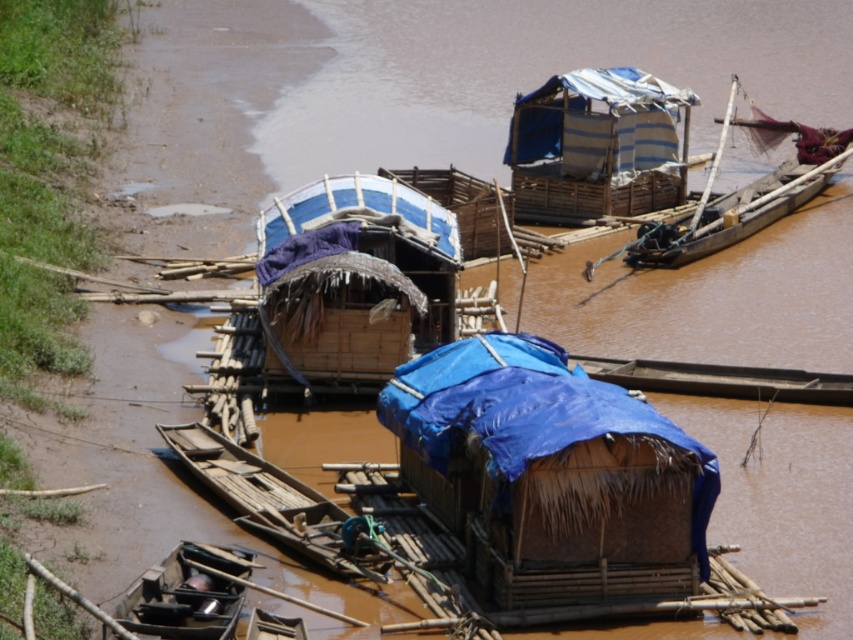
Looking at this image, does blue striped tarp at upper center appear under wooden boat at right?

No.

Can you confirm if blue striped tarp at upper center is bigger than wooden boat at right?

Actually, blue striped tarp at upper center might be smaller than wooden boat at right.

The width and height of the screenshot is (853, 640). What do you see at coordinates (598, 145) in the screenshot?
I see `blue striped tarp at upper center` at bounding box center [598, 145].

Where is `blue striped tarp at upper center`? The height and width of the screenshot is (640, 853). blue striped tarp at upper center is located at coordinates (598, 145).

Can you confirm if wooden boat at center is smaller than black matte boat at lower left?

No, wooden boat at center is not smaller than black matte boat at lower left.

Which is behind, point (279, 516) or point (236, 576)?

The point (279, 516) is more distant.

Is point (244, 474) farther from camera compared to point (158, 630)?

Yes, it is behind point (158, 630).

At what (x,y) coordinates should I click in order to perform the action: click on wooden boat at center. Please return your answer as a coordinate pair (x, y). The image size is (853, 640). Looking at the image, I should click on (268, 497).

Who is positioned more to the left, blue tarpaulin hut at center or black matte boat at lower left?

black matte boat at lower left is more to the left.

Does point (639, 572) lie behind point (216, 634)?

Yes.

Where is `blue tarpaulin hut at center`? The image size is (853, 640). blue tarpaulin hut at center is located at coordinates (550, 472).